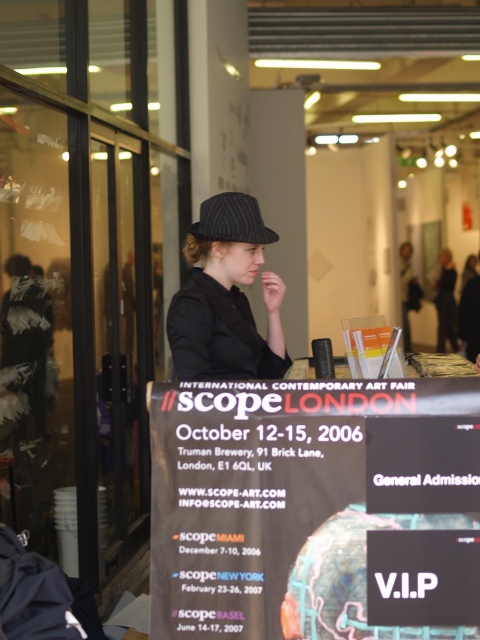
You are a photographer at Scope London art fair. You need to capture a photo of the two hats on the counter. According to the scene description, which hat is positioned lower on the counter between the matte black hat at center and the dark blue pinstripe baseball hat at center?

The matte black hat at center is positioned lower on the counter because it is below the dark blue pinstripe baseball hat at center.

You are a fashion designer attending Scope London and want to place both the matte black hat at center and the dark blue pinstripe baseball hat at center on a display stand. If the stand can only accommodate one hat at a time, which hat would you choose to showcase first based on their sizes?

The matte black hat at center has a larger width than the dark blue pinstripe baseball hat at center, so it should be showcased first due to its bigger size.